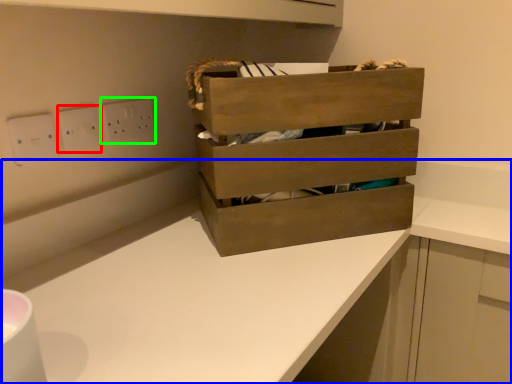
Question: Which object is positioned closest to electric outlet (highlighted by a red box)? Select from counter (highlighted by a blue box) and electric outlet (highlighted by a green box).

Choices:
 (A) counter
 (B) electric outlet

Answer: (B)